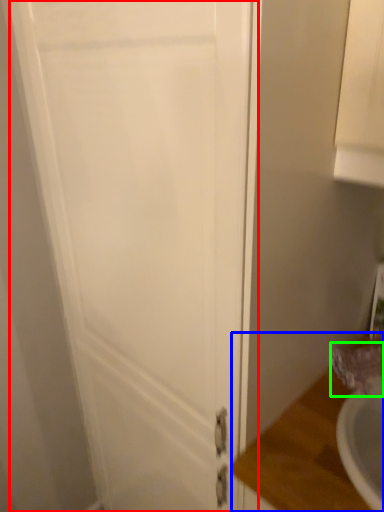
Question: Estimate the real-world distances between objects in this image. Which object is farther from door (highlighted by a red box), counter top (highlighted by a blue box) or faucet (highlighted by a green box)?

Choices:
 (A) counter top
 (B) faucet

Answer: (B)